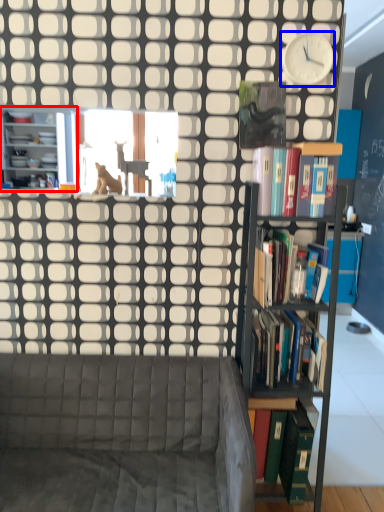
Question: Which object is further to the camera taking this photo, bookcase (highlighted by a red box) or clock (highlighted by a blue box)?

Choices:
 (A) bookcase
 (B) clock

Answer: (A)